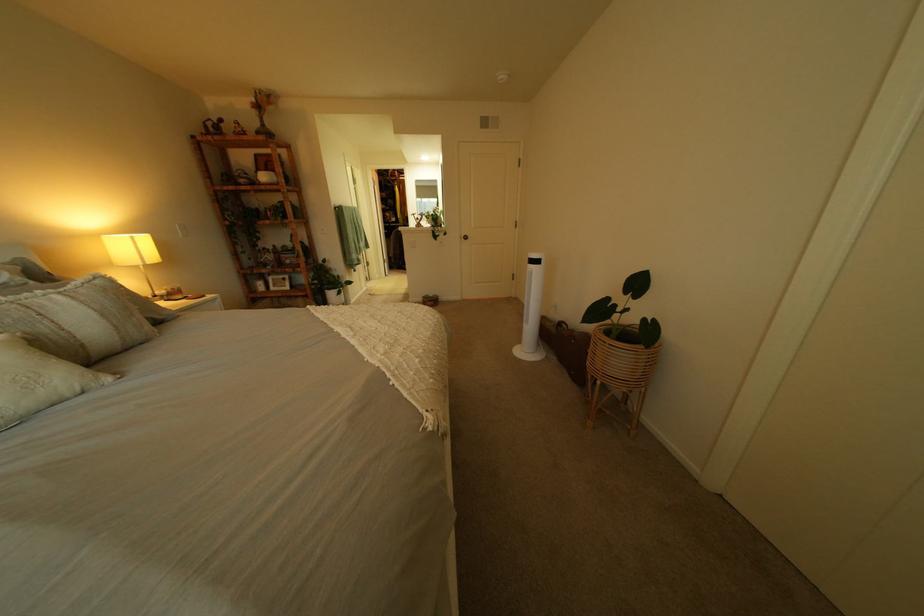
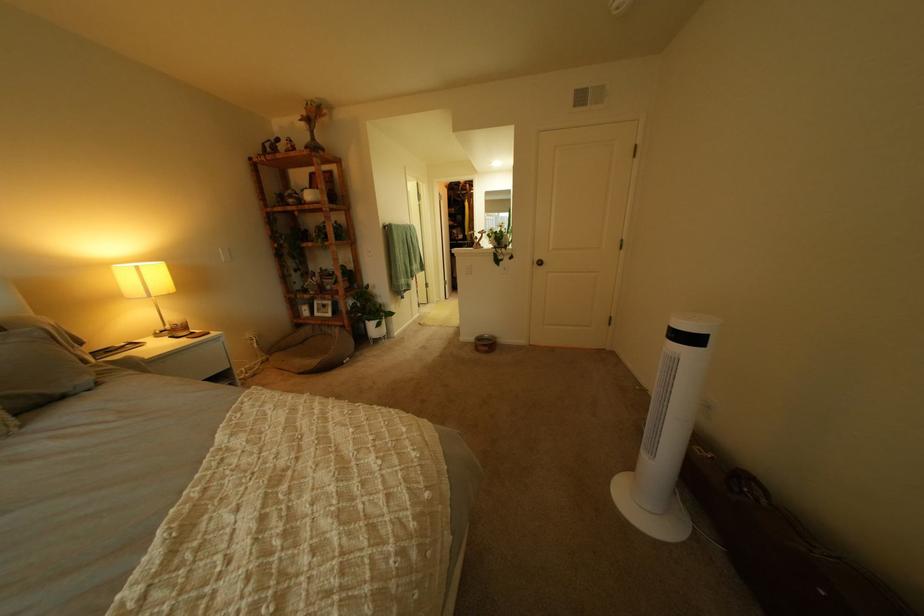
The point at [193,317] is marked in the first image. Where is the corresponding point in the second image?

(115, 385)